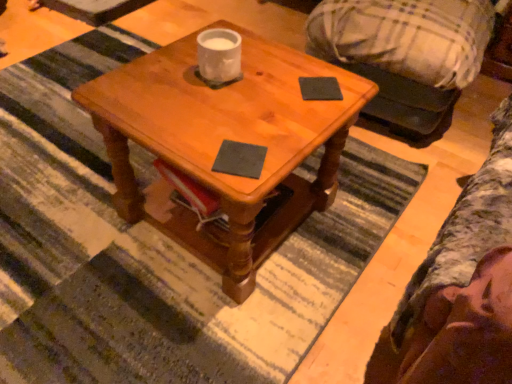
Where is `free location to the left of dark gray matte notepad at center, the 1th notepad in the front-to-back sequence`? This screenshot has height=384, width=512. free location to the left of dark gray matte notepad at center, the 1th notepad in the front-to-back sequence is located at coordinates (184, 141).